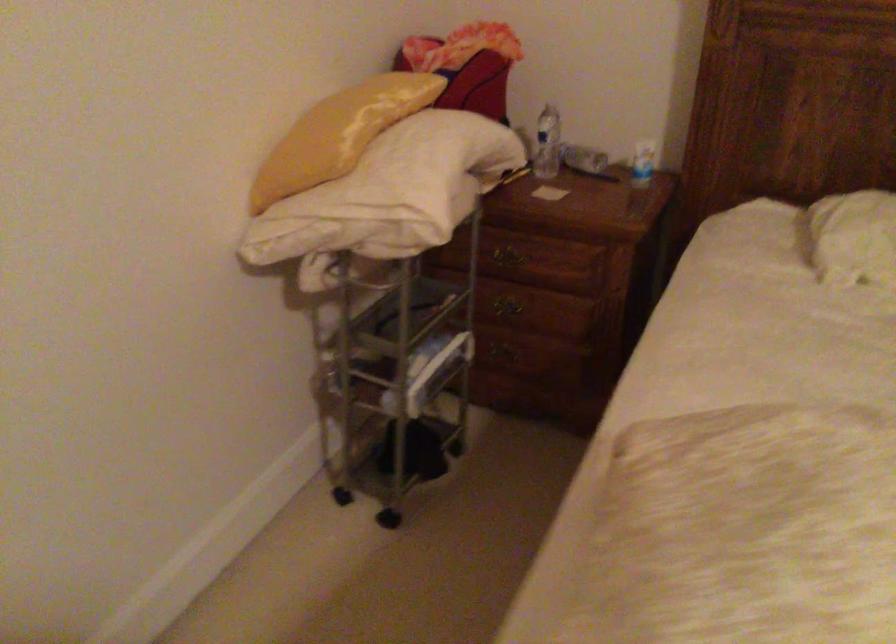
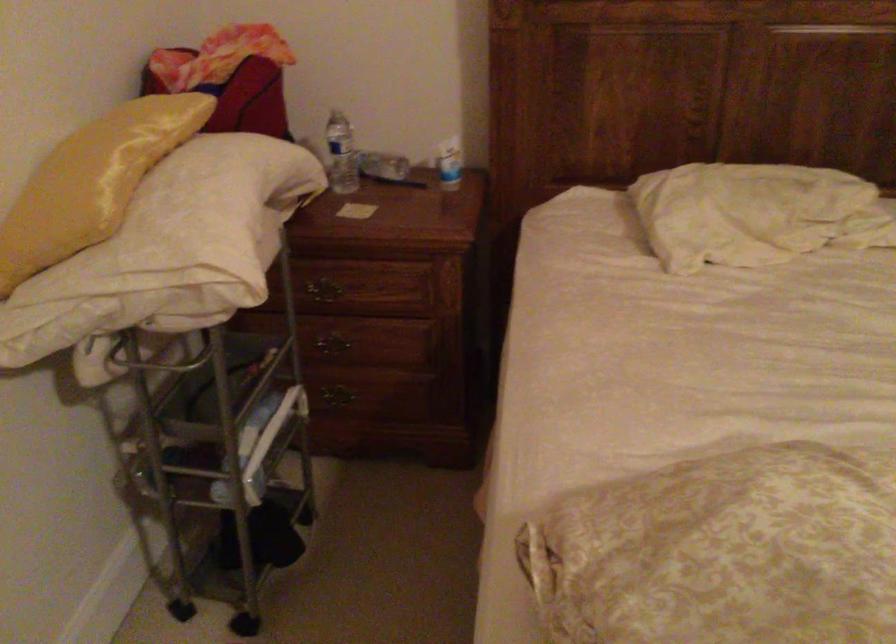
Question: The first image is from the beginning of the video and the second image is from the end. How did the camera likely rotate when shooting the video?

Choices:
 (A) Left
 (B) Right
 (C) Up
 (D) Down

Answer: (B)